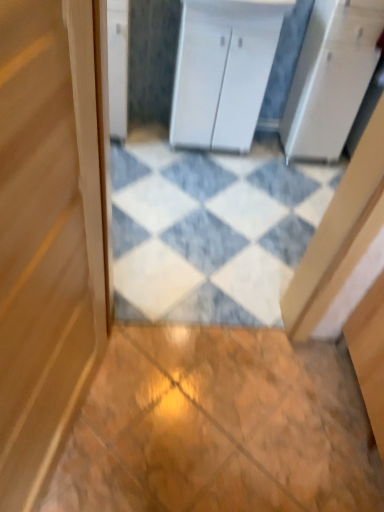
The height and width of the screenshot is (512, 384). What are the coordinates of `unoccupied region to the right of white glossy cabinet at upper left, the second cabinetry viewed from the right` in the screenshot? It's located at (144, 139).